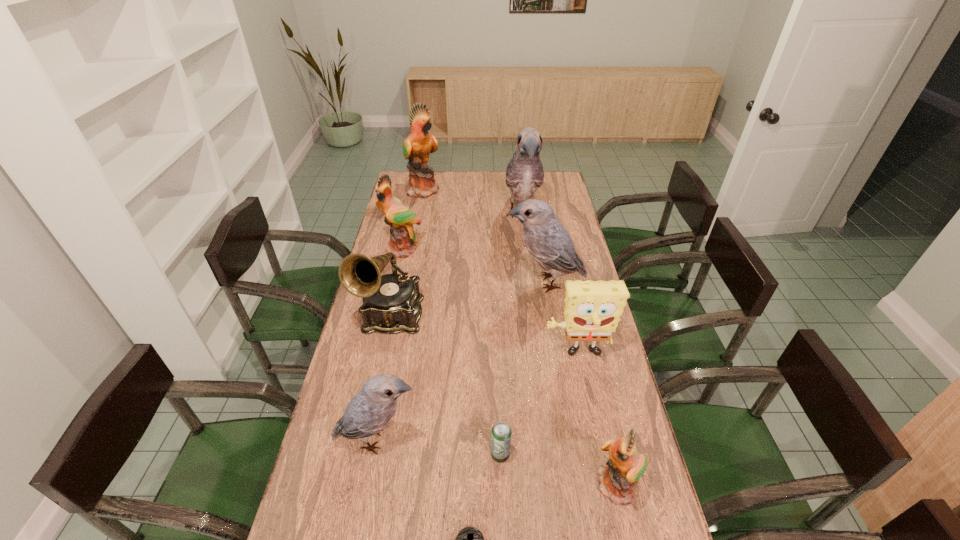
The width and height of the screenshot is (960, 540). What are the coordinates of `blank space located on the face of the yellow sponge` in the screenshot? It's located at (585, 396).

This screenshot has height=540, width=960. Find the location of `vacant space located on the front-facing side of the smallest gray parrot`. vacant space located on the front-facing side of the smallest gray parrot is located at coordinates (549, 440).

Where is `blank area located 0.060m on the back of the beer can`? blank area located 0.060m on the back of the beer can is located at coordinates (499, 426).

The height and width of the screenshot is (540, 960). Find the location of `phonograph record present at the left edge`. phonograph record present at the left edge is located at coordinates (391, 304).

This screenshot has width=960, height=540. Find the location of `sponge present at the right edge`. sponge present at the right edge is located at coordinates (592, 309).

Where is `object located at the far left corner`? The width and height of the screenshot is (960, 540). object located at the far left corner is located at coordinates tap(417, 147).

You are a GUI agent. You are given a task and a screenshot of the screen. Output one action in this format:
    pyautogui.click(x=<x>, y=<y>)
    Task: Click on the object that is at the far right corner
    
    Given the screenshot: What is the action you would take?
    pyautogui.click(x=524, y=174)

The image size is (960, 540). In the image, there is a desktop. In order to click on free space at the far edge in this screenshot , I will do `click(455, 180)`.

Find the location of a particular element. The image size is (960, 540). free space at the left edge of the desktop is located at coordinates (390, 266).

Where is `free space at the right edge of the desktop`? This screenshot has width=960, height=540. free space at the right edge of the desktop is located at coordinates (625, 401).